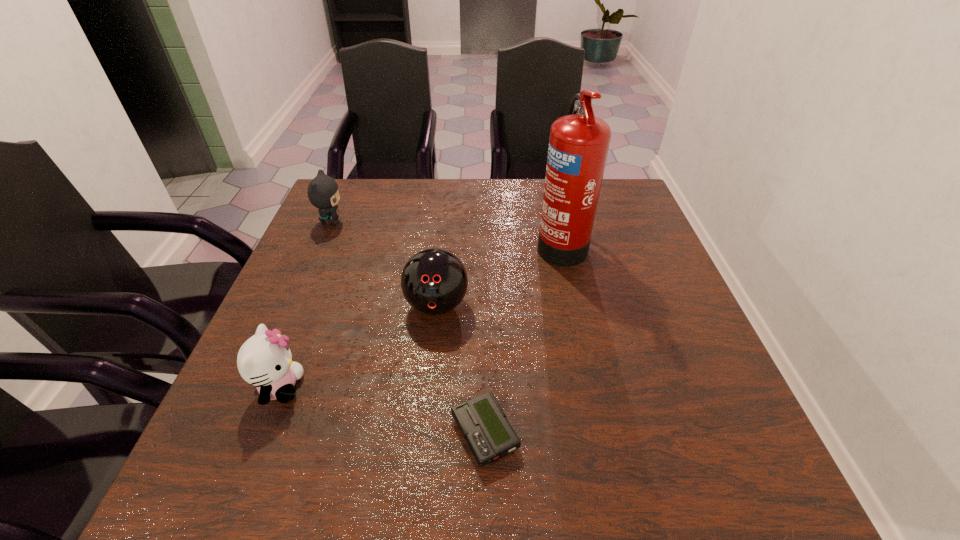
Where is `vacant point that satisfies the following two spatial constraints: 1. on the front-facing side of the farther kitten; 2. on the left side of the beeper`? vacant point that satisfies the following two spatial constraints: 1. on the front-facing side of the farther kitten; 2. on the left side of the beeper is located at coordinates (240, 434).

The width and height of the screenshot is (960, 540). In order to click on vacant region that satisfies the following two spatial constraints: 1. on the surface of the third farthest object near the finger holes; 2. on the right side of the beeper in this screenshot , I will do `click(423, 434)`.